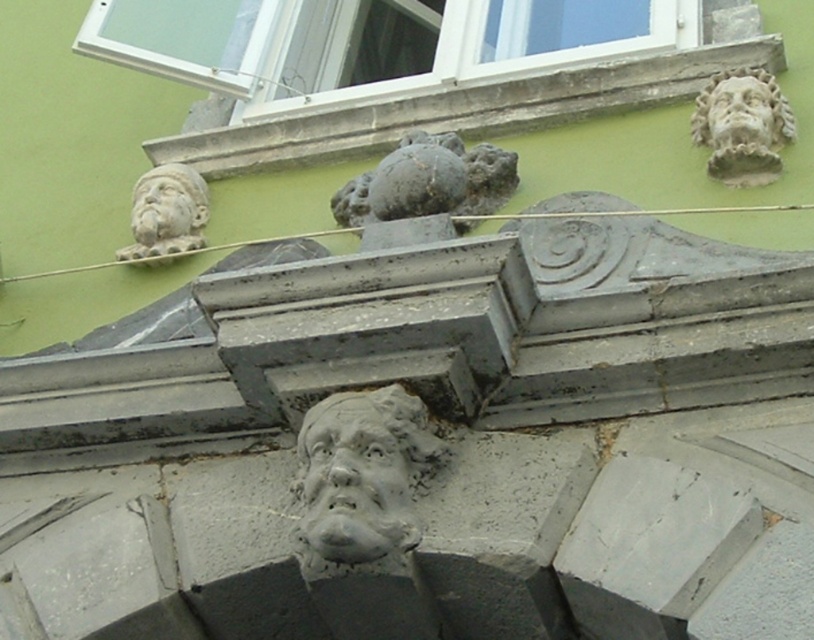
You are standing 40 meters away from the gray stone head at upper right. Can you reach it without moving closer?

The gray stone head at upper right is 40.17 meters away from the viewer, so you are currently 40 meters away. Since you are slightly farther than 40 meters, you cannot reach it without moving closer.

You are an architect analyzing the building facade. You notice the gray stone face at center and the matte gray stone face at upper left. Which of these two faces is bigger?

The gray stone face at center is larger in size than the matte gray stone face at upper left.

You are a painter standing 10 meters away from the gray stone face at center and the gray stone head at upper right. You want to paint both of them in detail. Can you reach both with your 12 meter long paintbrush?

The gray stone face at center and gray stone head at upper right are 11.34 meters apart. Since your paintbrush is 12 meters long, you can reach both as the distance between them is less than the brush length.